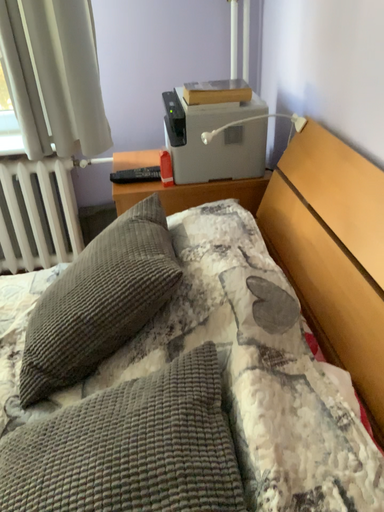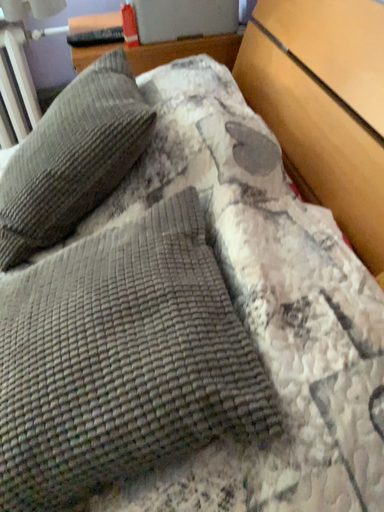
Question: Which way did the camera rotate in the video?

Choices:
 (A) rotated upward
 (B) rotated downward

Answer: (B)